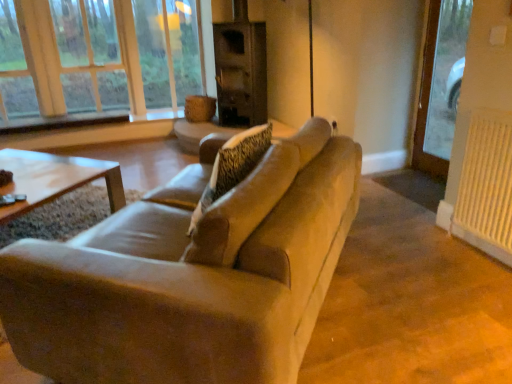
Question: Considering the relative sizes of beige fabric couch at center and white textured radiator at right in the image provided, is beige fabric couch at center shorter than white textured radiator at right?

Choices:
 (A) no
 (B) yes

Answer: (B)

Question: Is beige fabric couch at center behind white textured radiator at right?

Choices:
 (A) yes
 (B) no

Answer: (B)

Question: Does beige fabric couch at center have a greater width compared to white textured radiator at right?

Choices:
 (A) no
 (B) yes

Answer: (B)

Question: Are beige fabric couch at center and white textured radiator at right far apart?

Choices:
 (A) yes
 (B) no

Answer: (A)

Question: Is beige fabric couch at center taller than white textured radiator at right?

Choices:
 (A) no
 (B) yes

Answer: (A)

Question: Is point (95, 54) closer or farther from the camera than point (202, 377)?

Choices:
 (A) farther
 (B) closer

Answer: (A)

Question: Considering the relative positions of wooden frame at upper left and beige fabric couch at center in the image provided, is wooden frame at upper left to the left or to the right of beige fabric couch at center?

Choices:
 (A) left
 (B) right

Answer: (A)

Question: Based on their sizes in the image, would you say wooden frame at upper left is bigger or smaller than beige fabric couch at center?

Choices:
 (A) small
 (B) big

Answer: (A)

Question: Considering the positions of wooden frame at upper left and beige fabric couch at center in the image, is wooden frame at upper left taller or shorter than beige fabric couch at center?

Choices:
 (A) tall
 (B) short

Answer: (A)

Question: In terms of width, does beige fabric couch at center look wider or thinner when compared to white textured radiator at right?

Choices:
 (A) wide
 (B) thin

Answer: (A)

Question: From the image's perspective, relative to white textured radiator at right, is beige fabric couch at center above or below?

Choices:
 (A) above
 (B) below

Answer: (B)

Question: Considering their positions, is beige fabric couch at center located in front of or behind white textured radiator at right?

Choices:
 (A) front
 (B) behind

Answer: (A)

Question: Is point (117, 302) closer or farther from the camera than point (494, 215)?

Choices:
 (A) farther
 (B) closer

Answer: (B)

Question: Is beige fabric couch at center to the left or to the right of dark brown wood fireplace at center in the image?

Choices:
 (A) left
 (B) right

Answer: (A)

Question: Based on their sizes in the image, would you say beige fabric couch at center is bigger or smaller than dark brown wood fireplace at center?

Choices:
 (A) small
 (B) big

Answer: (B)